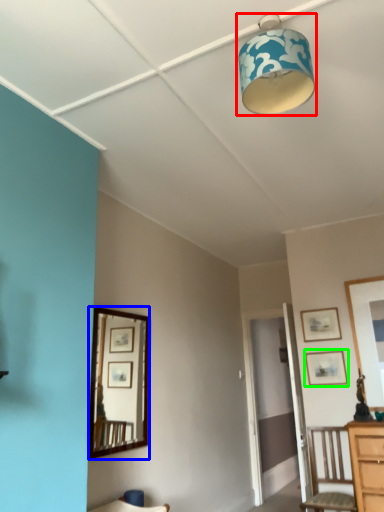
Question: Which object is positioned farthest from lamp (highlighted by a red box)? Select from mirror (highlighted by a blue box) and picture frame (highlighted by a green box).

Choices:
 (A) mirror
 (B) picture frame

Answer: (A)